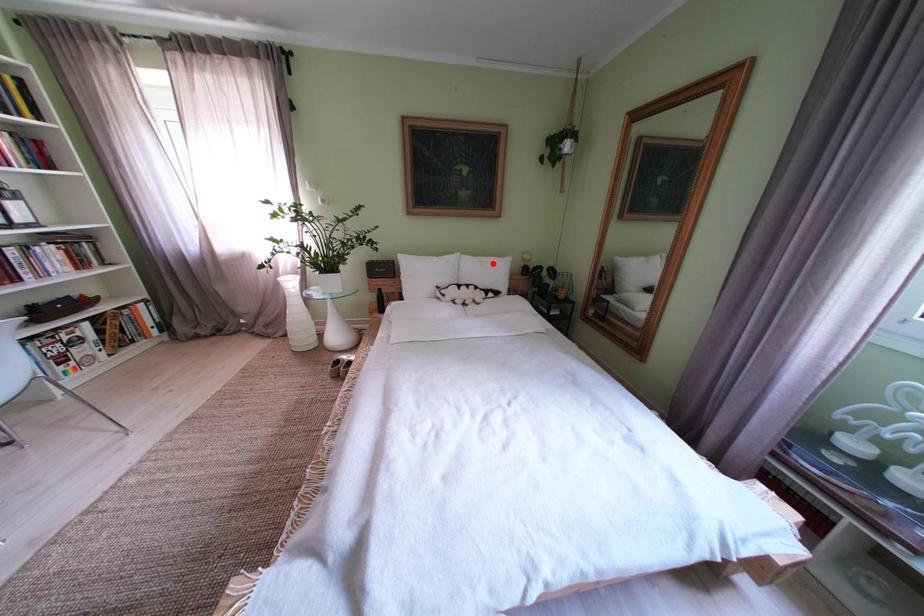
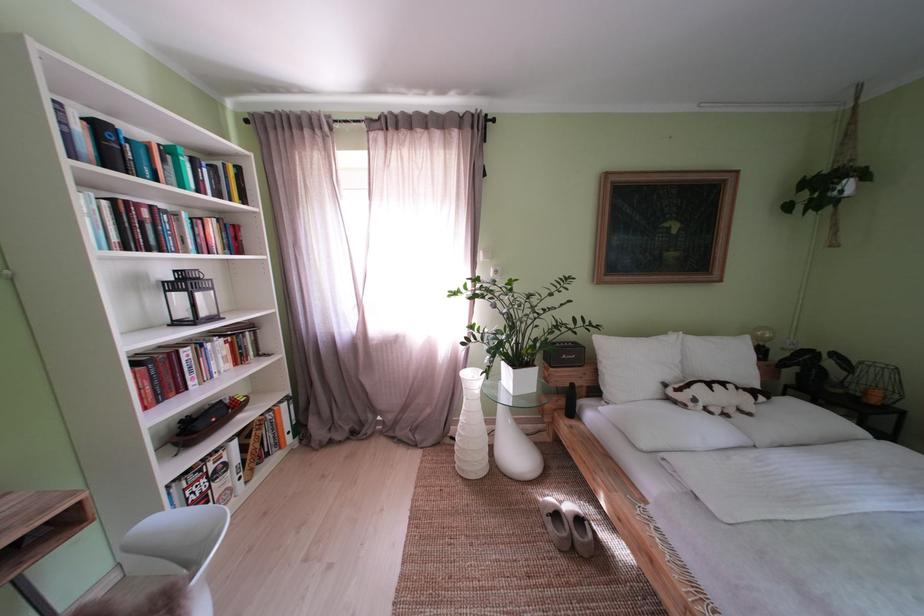
In the second image, find the point that corresponds to the highlighted location in the first image.

(723, 344)